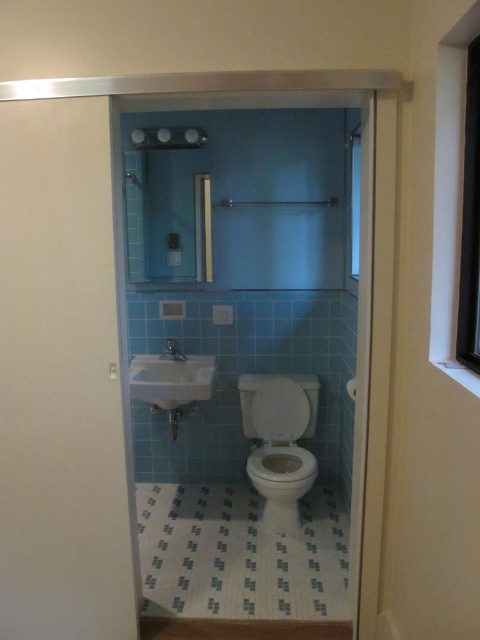
Which of these two, white wood window at upper right or transparent glass window at upper right, stands shorter?

With less height is transparent glass window at upper right.

Based on the photo, is white wood window at upper right smaller than transparent glass window at upper right?

No, white wood window at upper right is not smaller than transparent glass window at upper right.

Identify the location of white wood window at upper right. (450, 195).

Is white glossy sink at lower left to the left of matte silver faucet at center from the viewer's perspective?

In fact, white glossy sink at lower left is to the right of matte silver faucet at center.

Locate an element on the screen. white glossy sink at lower left is located at coordinates (170, 380).

Consider the image. How far apart are white wood window at upper right and white glossy toilet at center?

white wood window at upper right is 1.54 meters from white glossy toilet at center.

Which is in front, point (457, 253) or point (289, 524)?

Point (457, 253) is more forward.

Where is `white wood window at upper right`? The width and height of the screenshot is (480, 640). white wood window at upper right is located at coordinates (450, 195).

In order to click on white wood window at upper right in this screenshot , I will do `click(450, 195)`.